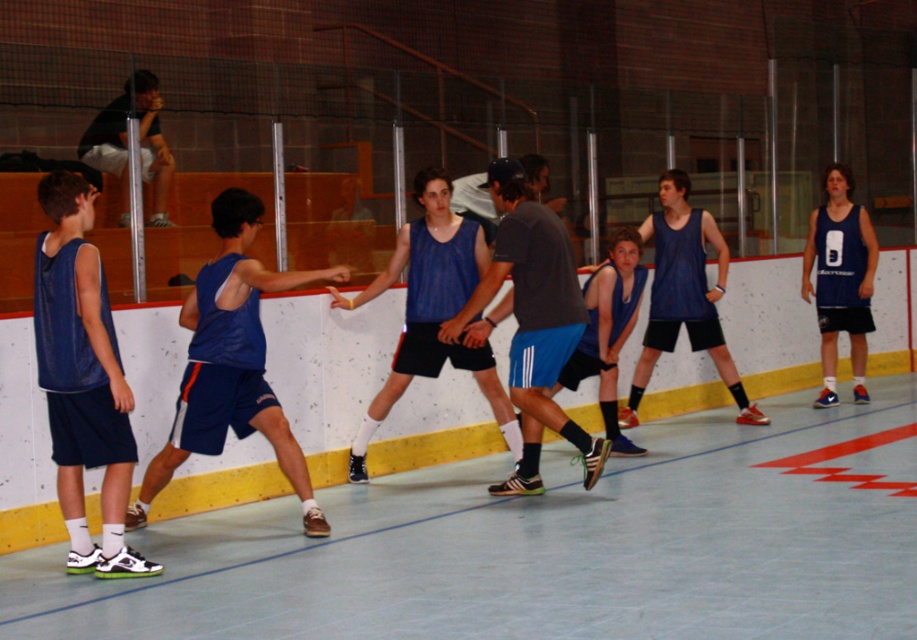
Question: Among these points, which one is nearest to the camera?

Choices:
 (A) (294, 310)
 (B) (197, 289)
 (C) (102, 355)

Answer: (C)

Question: Estimate the real-world distances between objects in this image. Which object is farther from the matte blue tank top at left?

Choices:
 (A) matte black shorts at center
 (B) black jersey at upper left
 (C) matte blue tank top at center

Answer: (A)

Question: Does matte blue tank top at left have a lesser width compared to matte blue tank top at center?

Choices:
 (A) yes
 (B) no

Answer: (A)

Question: Is matte black shorts at center to the right of black jersey at upper left from the viewer's perspective?

Choices:
 (A) no
 (B) yes

Answer: (B)

Question: Is matte blue tank top at center closer to camera compared to black jersey at upper left?

Choices:
 (A) no
 (B) yes

Answer: (B)

Question: Based on their relative distances, which object is nearer to the matte black shorts at center?

Choices:
 (A) black jersey at upper left
 (B) matte blue shorts at left
 (C) matte blue tank top at center

Answer: (B)